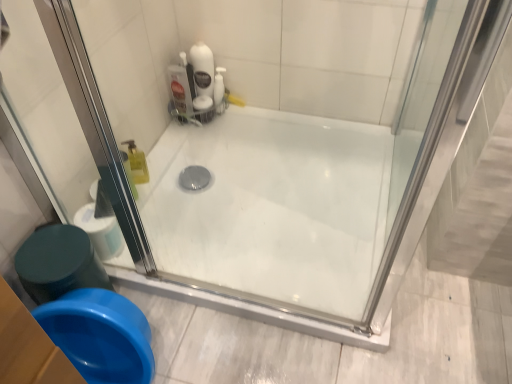
Measure the distance between point (x=91, y=219) and camera.

Point (x=91, y=219) and camera are 1.20 meters apart from each other.

Describe the element at coordinates (100, 232) in the screenshot. I see `white matte toilet paper at lower left` at that location.

In order to click on white matte toilet paper at lower left in this screenshot , I will do `click(100, 232)`.

I want to click on white matte toilet paper at lower left, so click(x=100, y=232).